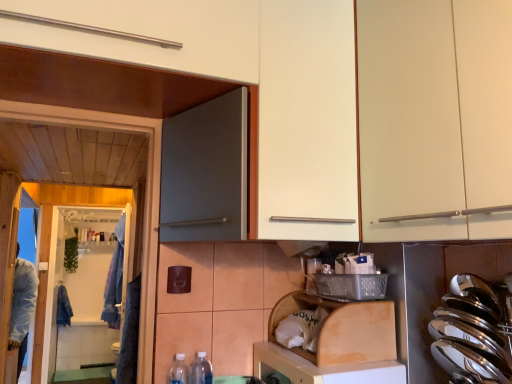
Question: Is polished stainless steel spoons at right at the right side of denim jacket at left, the 1th laundry positioned from the left?

Choices:
 (A) yes
 (B) no

Answer: (A)

Question: Would you say polished stainless steel spoons at right is outside denim jacket at left, the 2th laundry when ordered from front to back?

Choices:
 (A) yes
 (B) no

Answer: (A)

Question: Can you confirm if polished stainless steel spoons at right is smaller than denim jacket at left, the 2th laundry when ordered from front to back?

Choices:
 (A) no
 (B) yes

Answer: (B)

Question: Is polished stainless steel spoons at right positioned with its back to denim jacket at left, the 1th laundry positioned from the left?

Choices:
 (A) no
 (B) yes

Answer: (A)

Question: Is polished stainless steel spoons at right taller than denim jacket at left, the 2th laundry when ordered from front to back?

Choices:
 (A) yes
 (B) no

Answer: (B)

Question: Relative to wooden dish washer at lower center, the second dish washer when ordered from bottom to top, is clear plastic bottle at lower center in front or behind?

Choices:
 (A) front
 (B) behind

Answer: (B)

Question: Looking at their shapes, would you say clear plastic bottle at lower center is wider or thinner than wooden dish washer at lower center, the second dish washer when ordered from bottom to top?

Choices:
 (A) wide
 (B) thin

Answer: (B)

Question: Is clear plastic bottle at lower center taller or shorter than wooden dish washer at lower center, the second dish washer when ordered from bottom to top?

Choices:
 (A) short
 (B) tall

Answer: (B)

Question: Is clear plastic bottle at lower center inside the boundaries of wooden dish washer at lower center, the second dish washer when ordered from bottom to top, or outside?

Choices:
 (A) outside
 (B) inside

Answer: (A)

Question: From the image's perspective, relative to white matte cabinet at upper right, is denim jacket at left, which ranks as the first laundry in right-to-left order, above or below?

Choices:
 (A) above
 (B) below

Answer: (B)

Question: Is denim jacket at left, the second laundry when ordered from back to front, wider or thinner than white matte cabinet at upper right?

Choices:
 (A) thin
 (B) wide

Answer: (B)

Question: Based on their positions, is denim jacket at left, the 2th laundry viewed from the left, located to the left or right of white matte cabinet at upper right?

Choices:
 (A) right
 (B) left

Answer: (B)

Question: Considering their positions, is denim jacket at left, the 2th laundry viewed from the left, located in front of or behind white matte cabinet at upper right?

Choices:
 (A) front
 (B) behind

Answer: (B)

Question: In terms of width, does clear plastic bottle at lower center look wider or thinner when compared to white glossy screen door at lower left?

Choices:
 (A) wide
 (B) thin

Answer: (A)

Question: From a real-world perspective, relative to white glossy screen door at lower left, is clear plastic bottle at lower center vertically above or below?

Choices:
 (A) above
 (B) below

Answer: (B)